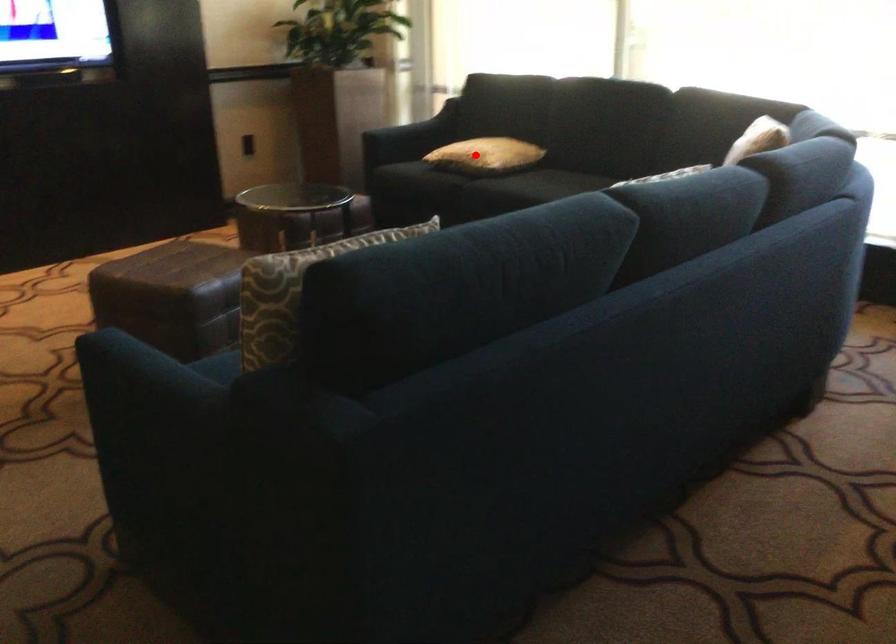
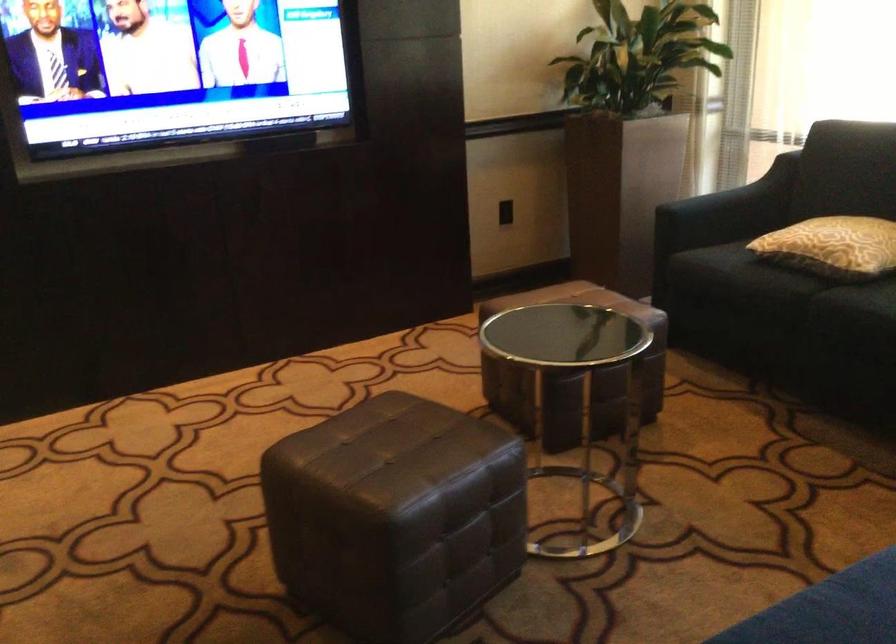
Locate, in the second image, the point that corresponds to the highlighted location in the first image.

(832, 245)